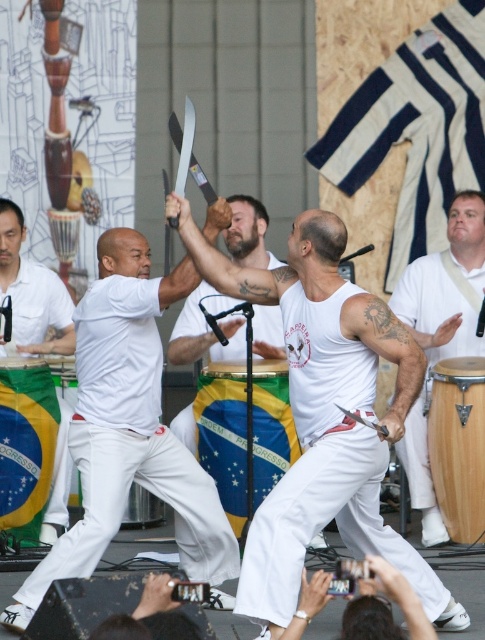
Is blue-green fabric drum at center thinner than white cotton shirt at left?

In fact, blue-green fabric drum at center might be wider than white cotton shirt at left.

The image size is (485, 640). What do you see at coordinates (224, 435) in the screenshot?
I see `blue-green fabric drum at center` at bounding box center [224, 435].

Where is `blue-green fabric drum at center`? blue-green fabric drum at center is located at coordinates (224, 435).

Which is above, white cotton pants at left or white cotton shirt at left?

white cotton pants at left is higher up.

Is point (66, 435) in front of point (50, 305)?

Yes, point (66, 435) is closer to viewer.

Locate an element on the screen. Image resolution: width=485 pixels, height=640 pixels. white cotton pants at left is located at coordinates (32, 292).

Can you confirm if white smooth t-shirt at center is positioned below white cotton shirt at left?

Incorrect, white smooth t-shirt at center is not positioned below white cotton shirt at left.

This screenshot has width=485, height=640. What do you see at coordinates (448, 285) in the screenshot?
I see `white smooth t-shirt at center` at bounding box center [448, 285].

This screenshot has height=640, width=485. I want to click on white smooth t-shirt at center, so click(448, 285).